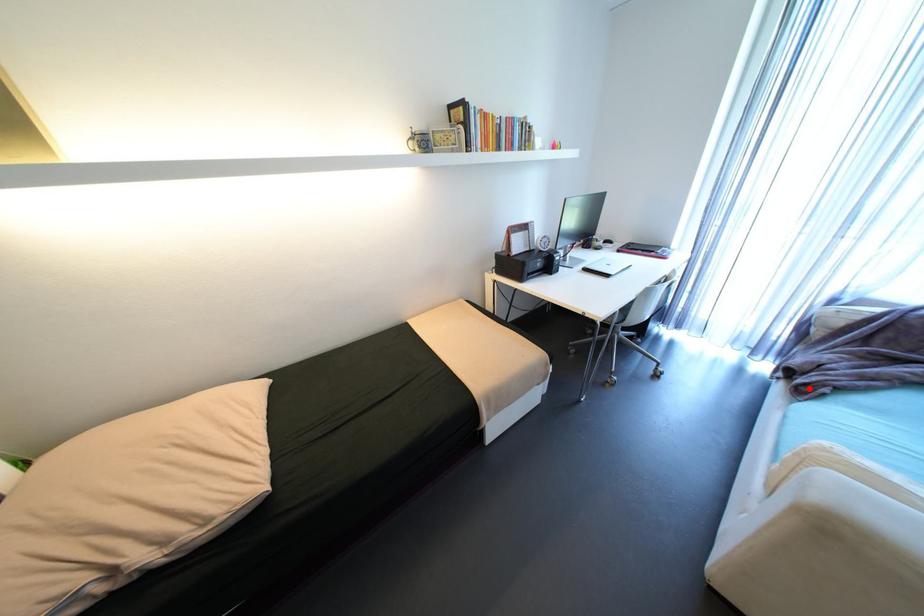
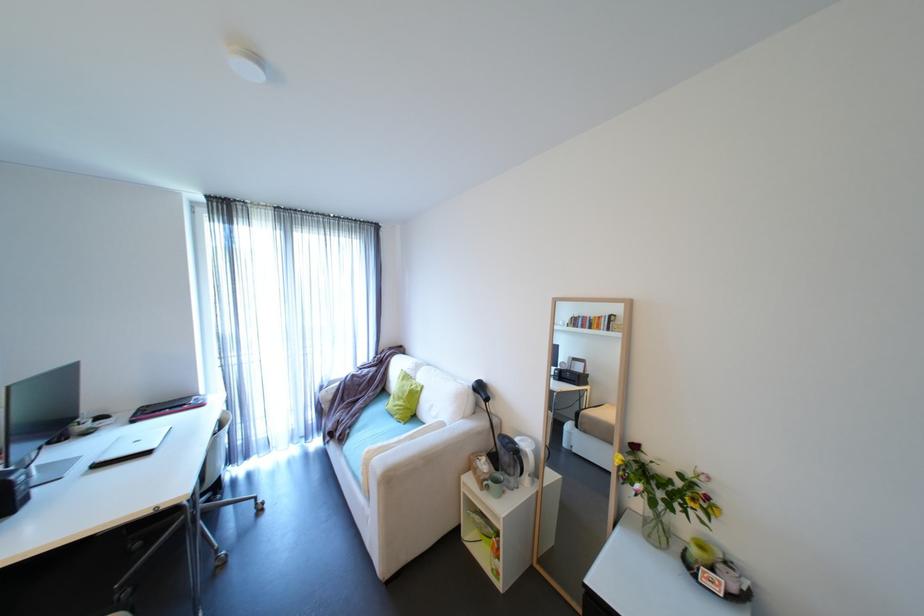
In the second image, find the point that corresponds to the highlighted location in the first image.

(347, 438)